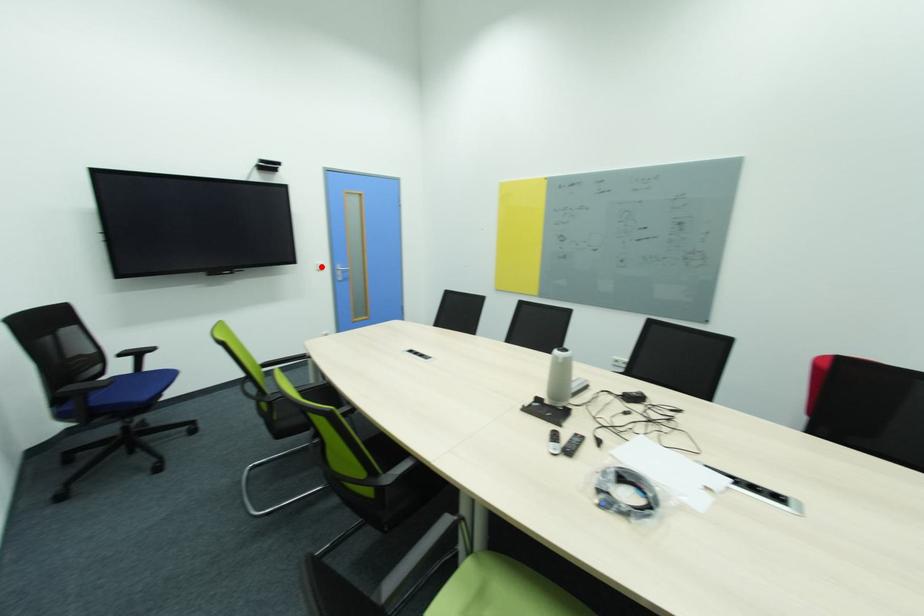
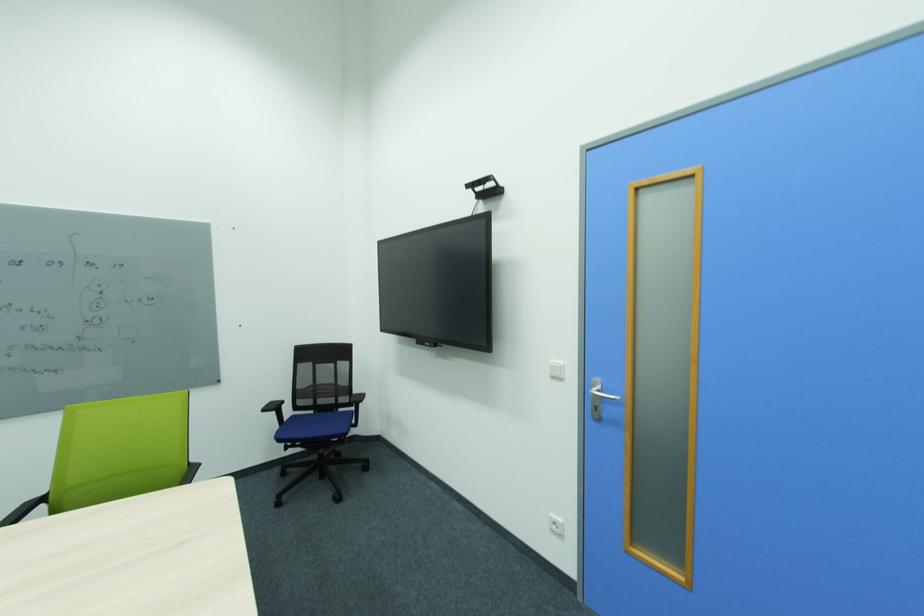
In the second image, find the point that corresponds to the highlighted location in the first image.

(557, 368)